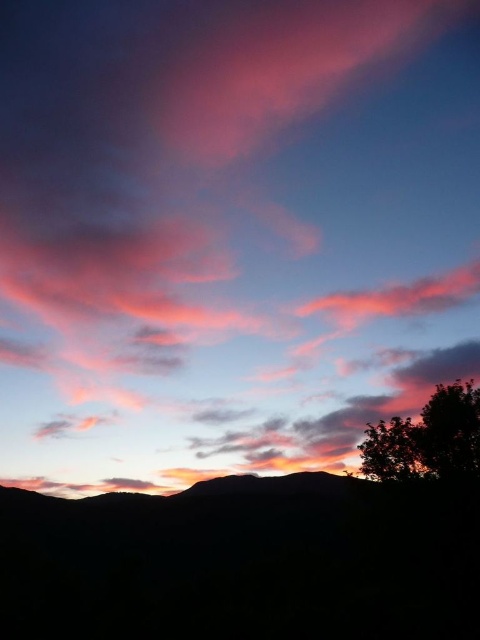
Question: Which point is closer to the camera?

Choices:
 (A) dark green leafy tree at lower right
 (B) silhouette mountain at center

Answer: (B)

Question: From the image, what is the correct spatial relationship of silhouette mountain at center in relation to dark green leafy tree at lower right?

Choices:
 (A) left
 (B) right

Answer: (A)

Question: Which point is farther from the camera taking this photo?

Choices:
 (A) (127, 589)
 (B) (410, 451)

Answer: (A)

Question: Can you confirm if silhouette mountain at center is smaller than dark green leafy tree at lower right?

Choices:
 (A) no
 (B) yes

Answer: (A)

Question: Which point is closer to the camera taking this photo?

Choices:
 (A) (274, 516)
 (B) (421, 467)

Answer: (B)

Question: Is silhouette mountain at center further to camera compared to dark green leafy tree at lower right?

Choices:
 (A) yes
 (B) no

Answer: (B)